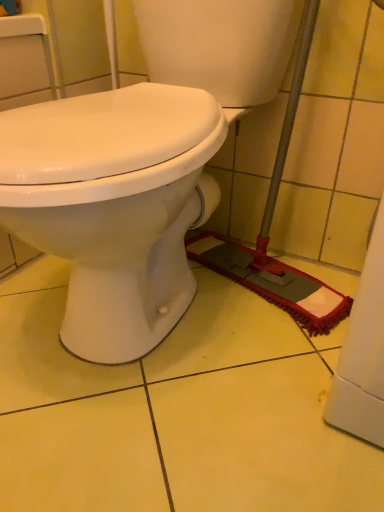
The width and height of the screenshot is (384, 512). What do you see at coordinates (140, 167) in the screenshot? I see `white glossy toilet at center` at bounding box center [140, 167].

The height and width of the screenshot is (512, 384). In order to click on white glossy toilet at center in this screenshot , I will do `click(140, 167)`.

At what (x,y) coordinates should I click in order to perform the action: click on white glossy toilet at center. Please return your answer as a coordinate pair (x, y). Looking at the image, I should click on (140, 167).